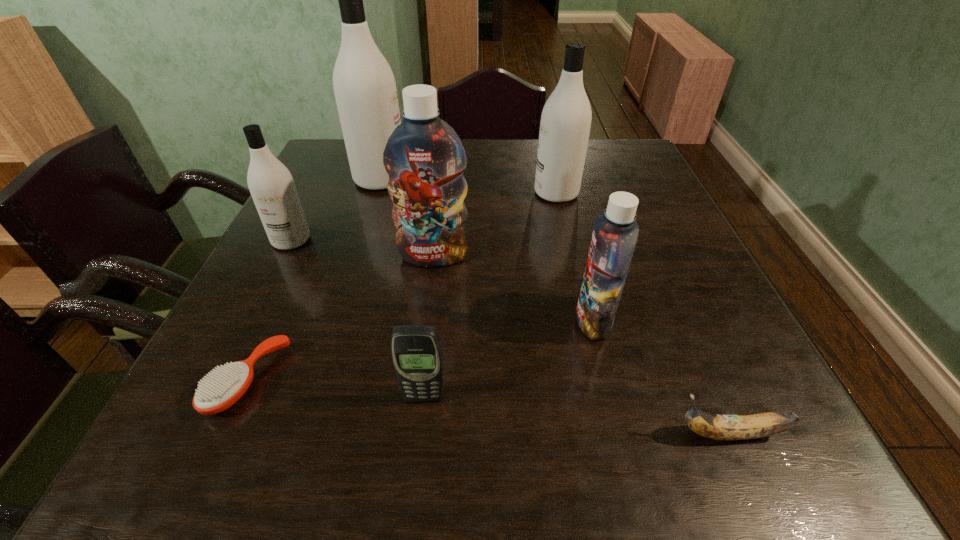
Where is `vacant space at the near left corner of the desktop`? This screenshot has height=540, width=960. vacant space at the near left corner of the desktop is located at coordinates (203, 464).

Image resolution: width=960 pixels, height=540 pixels. I want to click on vacant space at the far right corner of the desktop, so click(593, 157).

The image size is (960, 540). In order to click on vacant point located between the smaller blue shampoo and the farther blue shampoo in this screenshot , I will do `click(514, 288)`.

The width and height of the screenshot is (960, 540). In order to click on free area in between the smallest white shampoo and the banana in this screenshot , I will do `click(511, 337)`.

Find the location of a particular element. This screenshot has width=960, height=540. empty location between the farther blue shampoo and the banana is located at coordinates (582, 345).

In order to click on free point between the smallest white shampoo and the right blue shampoo in this screenshot , I will do `click(443, 280)`.

Locate an element on the screen. vacant area that lies between the orange hairbrush and the gray cellular telephone is located at coordinates (336, 389).

Identify the location of free point between the orange hairbrush and the gray cellular telephone. (336, 389).

Find the location of a particular element. Image resolution: width=960 pixels, height=540 pixels. vacant area that lies between the nearest object and the leftmost shampoo is located at coordinates [x=511, y=337].

You are a GUI agent. You are given a task and a screenshot of the screen. Output one action in this format:
    pyautogui.click(x=<x>, y=<y>)
    Task: Click on the unoccupied position between the hairbrush and the smallest white shampoo
    
    Given the screenshot: What is the action you would take?
    pyautogui.click(x=270, y=310)